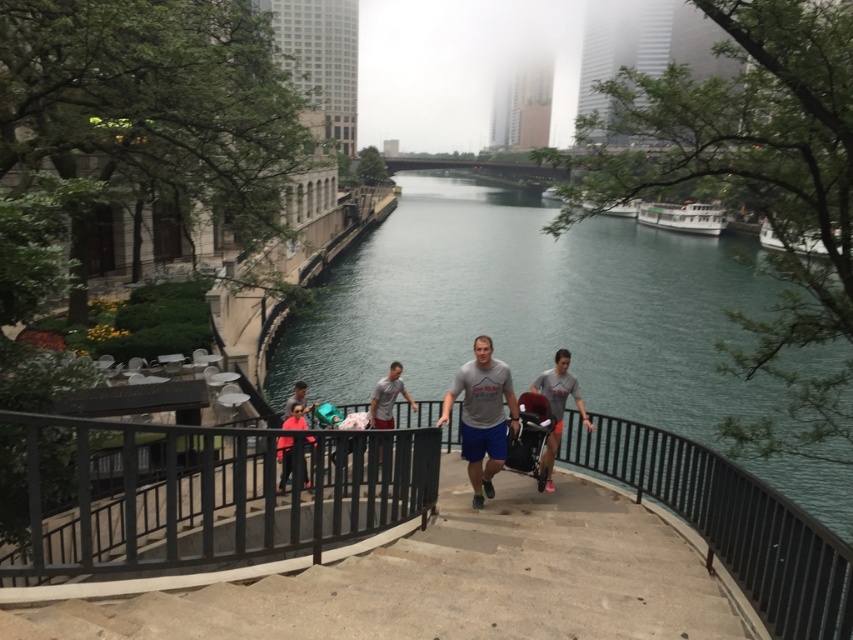
Question: Which of the following is the closest to the observer?

Choices:
 (A) white glossy boat at upper right
 (B) gray cotton shirt at center
 (C) gray fabric stroller at center
 (D) white matte boat at right

Answer: (B)

Question: Considering the real-world distances, which object is closest to the clear blue water at center?

Choices:
 (A) white glossy boat at upper center
 (B) white glossy boat at upper right
 (C) black metal balustrade at center

Answer: (C)

Question: Which point is closer to the camera taking this photo?

Choices:
 (A) (637, 209)
 (B) (566, 388)
 (C) (392, 417)

Answer: (B)

Question: Is black metal balustrade at center further to the viewer compared to gray fabric stroller at center?

Choices:
 (A) no
 (B) yes

Answer: (A)

Question: Does concrete stairs at center appear on the right side of matte pink shirt at center?

Choices:
 (A) no
 (B) yes

Answer: (B)

Question: Can you confirm if gray cotton t-shirt at center is wider than gray cotton shirt at center?

Choices:
 (A) yes
 (B) no

Answer: (A)